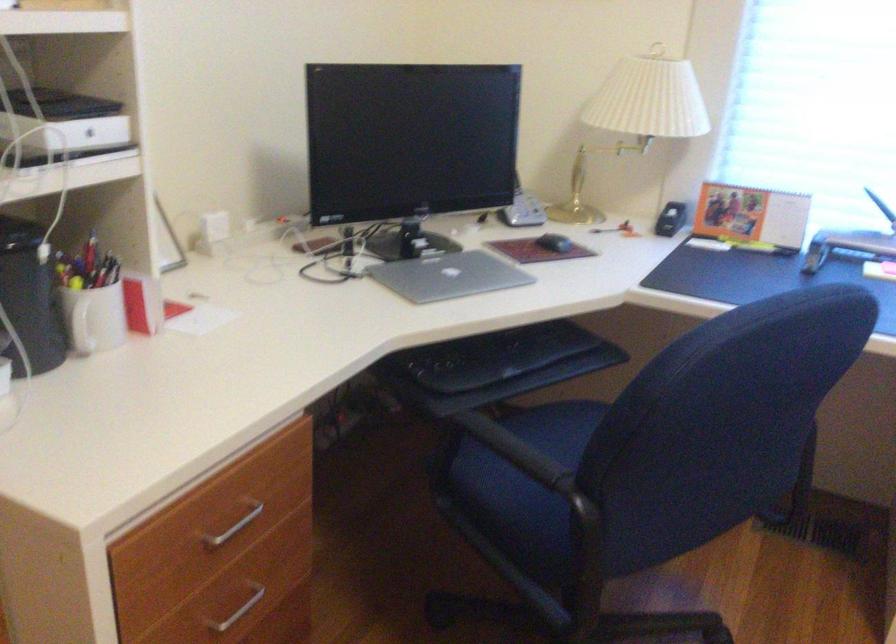
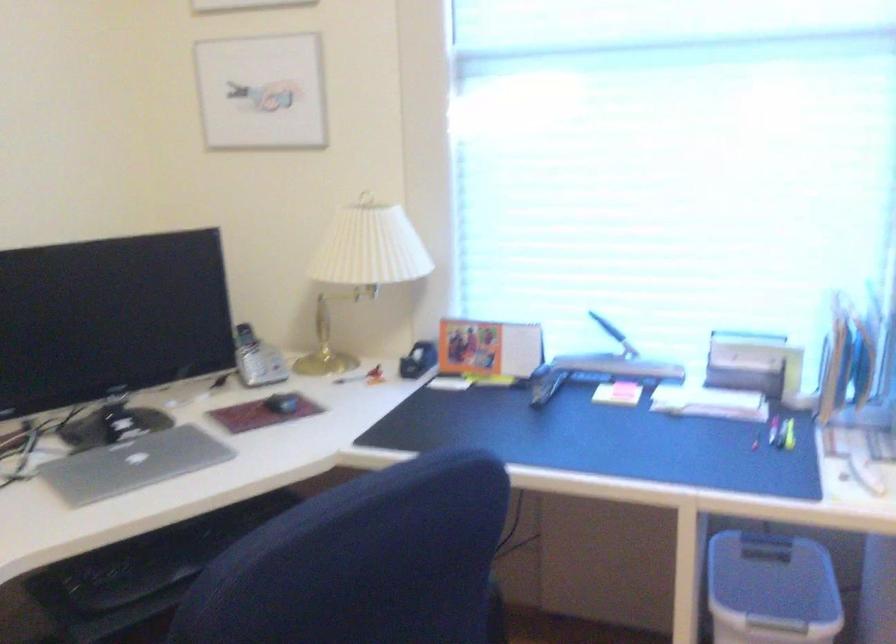
Question: Based on the continuous images, in which direction is the camera rotating? Reply with the corresponding letter.

Choices:
 (A) Left
 (B) Right
 (C) Up
 (D) Down

Answer: (B)